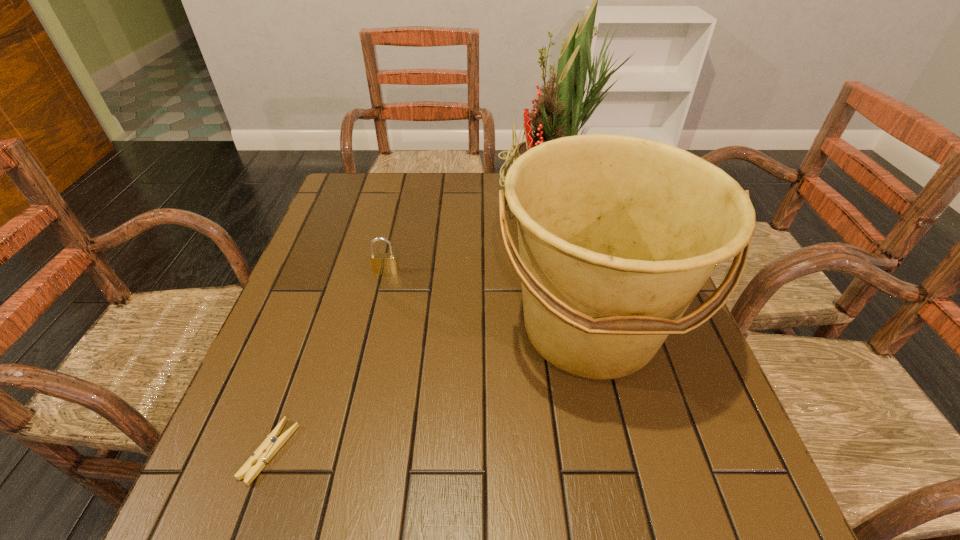
At what (x,y) coordinates should I click in order to perform the action: click on flower arrangement. Please return your answer as a coordinate pair (x, y). Looking at the image, I should click on (559, 113).

Locate an element on the screen. The width and height of the screenshot is (960, 540). the tallest object is located at coordinates (559, 113).

The height and width of the screenshot is (540, 960). I want to click on bucket, so click(617, 234).

You are a GUI agent. You are given a task and a screenshot of the screen. Output one action in this format:
    pyautogui.click(x=<x>, y=<y>)
    Task: Click on the second shortest object
    The width and height of the screenshot is (960, 540).
    Given the screenshot: What is the action you would take?
    pyautogui.click(x=382, y=263)

Image resolution: width=960 pixels, height=540 pixels. I want to click on the third object from right to left, so [382, 263].

The width and height of the screenshot is (960, 540). What are the coordinates of `the leftmost object` in the screenshot? It's located at (254, 465).

The height and width of the screenshot is (540, 960). In order to click on the nearest object in this screenshot , I will do `click(254, 465)`.

Identify the location of vacant space located 0.380m in front of the farthest object with the fan visible. (372, 198).

Locate an element on the screen. The image size is (960, 540). free space located 0.120m in front of the farthest object with the fan visible is located at coordinates (458, 198).

Locate an element on the screen. vacant space located 0.360m in front of the farthest object with the fan visible is located at coordinates (378, 198).